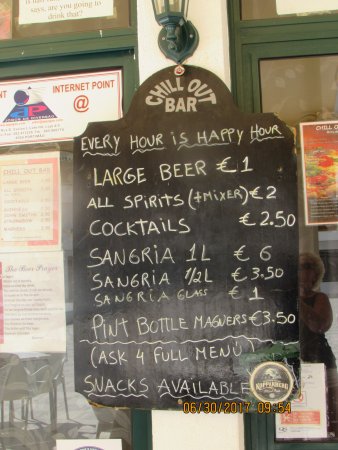
The width and height of the screenshot is (338, 450). I want to click on green border around window, so click(136, 429), click(259, 426).